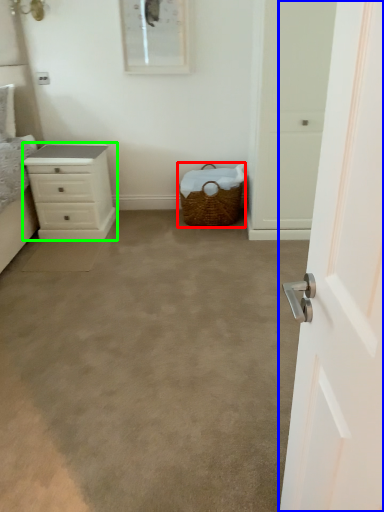
Question: Which object is positioned closest to picnic basket (highlighted by a red box)? Select from door (highlighted by a blue box) and chest of drawers (highlighted by a green box).

Choices:
 (A) door
 (B) chest of drawers

Answer: (B)